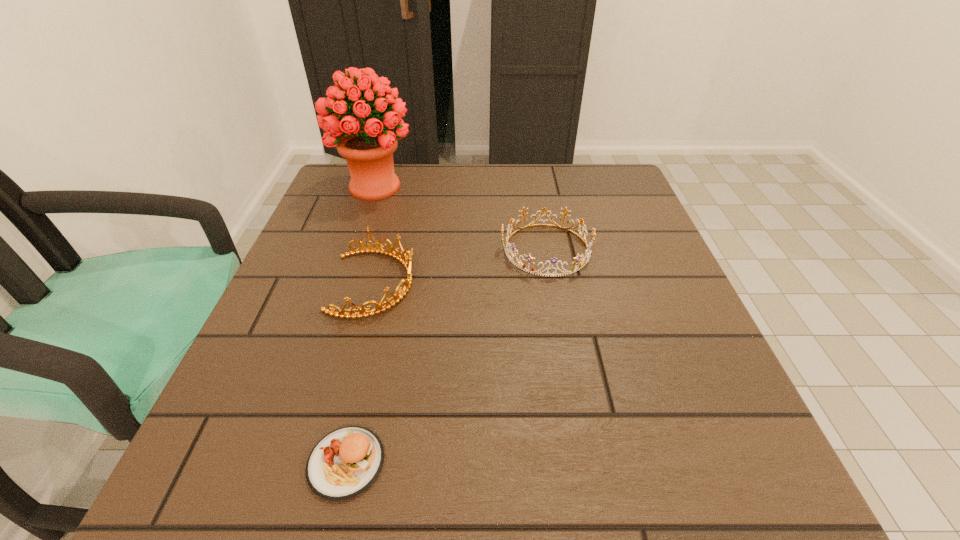
Where is `free space between the shorter tiara and the nearest object`? This screenshot has width=960, height=540. free space between the shorter tiara and the nearest object is located at coordinates [446, 356].

The height and width of the screenshot is (540, 960). In order to click on vacant space that's between the taller tiara and the right tiara in this screenshot , I will do `click(460, 266)`.

Find the location of a particular element. Image resolution: width=960 pixels, height=540 pixels. free point between the patty and the third shortest object is located at coordinates (360, 373).

Identify the location of vacant space in between the bouquet and the second shortest object. (461, 218).

Locate an element on the screen. The width and height of the screenshot is (960, 540). free spot between the nearest object and the rightmost object is located at coordinates (446, 356).

Identify the location of free space between the tallest object and the rightmost object. This screenshot has width=960, height=540. (461, 218).

Locate an element on the screen. This screenshot has width=960, height=540. object that stands as the closest to the left tiara is located at coordinates (368, 147).

Locate which object is the third closest to the shorter tiara. Please provide its 2D coordinates. Your answer should be formatted as a tuple, i.e. [(x, y)], where the tuple contains the x and y coordinates of a point satisfying the conditions above.

[(345, 462)]

Identify the location of vacant space that satisfies the following two spatial constraints: 1. on the front-facing side of the left tiara; 2. on the left side of the nearest object. (327, 463).

Find the location of a particular element. The image size is (960, 540). vacant position in the image that satisfies the following two spatial constraints: 1. on the front-facing side of the left tiara; 2. on the left side of the nearest object is located at coordinates (327, 463).